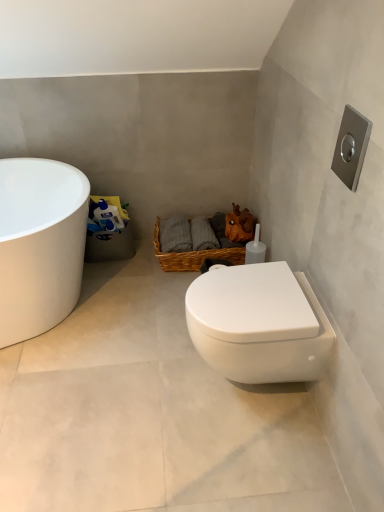
Question: Can you confirm if woven brown basket at center is thinner than white glossy toilet at lower right?

Choices:
 (A) yes
 (B) no

Answer: (A)

Question: Can you confirm if woven brown basket at center is shorter than white glossy toilet at lower right?

Choices:
 (A) no
 (B) yes

Answer: (A)

Question: Is woven brown basket at center bigger than white glossy toilet at lower right?

Choices:
 (A) no
 (B) yes

Answer: (A)

Question: Considering the relative sizes of woven brown basket at center and white glossy toilet at lower right in the image provided, is woven brown basket at center taller than white glossy toilet at lower right?

Choices:
 (A) yes
 (B) no

Answer: (A)

Question: From the image's perspective, is woven brown basket at center above white glossy toilet at lower right?

Choices:
 (A) yes
 (B) no

Answer: (A)

Question: Can you confirm if woven brown basket at center is smaller than white glossy toilet at lower right?

Choices:
 (A) yes
 (B) no

Answer: (A)

Question: Is white glossy toilet at lower right smaller than woven brown basket at center?

Choices:
 (A) no
 (B) yes

Answer: (A)

Question: Is white glossy toilet at lower right not inside woven brown basket at center?

Choices:
 (A) yes
 (B) no

Answer: (A)

Question: Can you confirm if white glossy toilet at lower right is taller than woven brown basket at center?

Choices:
 (A) yes
 (B) no

Answer: (A)

Question: Can woven brown basket at center be found inside white glossy toilet at lower right?

Choices:
 (A) yes
 (B) no

Answer: (B)

Question: Does white glossy toilet at lower right appear on the right side of woven brown basket at center?

Choices:
 (A) yes
 (B) no

Answer: (A)

Question: Is white glossy toilet at lower right oriented away from woven brown basket at center?

Choices:
 (A) yes
 (B) no

Answer: (B)

Question: Does white glossy toilet at lower right have a lesser width compared to white glossy bathtub at left?

Choices:
 (A) no
 (B) yes

Answer: (A)